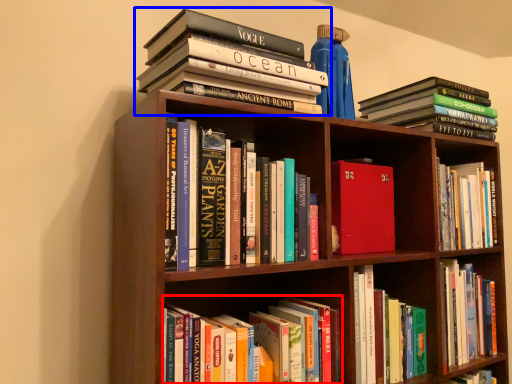
Question: Which object appears farthest to the camera in this image, book (highlighted by a red box) or book (highlighted by a blue box)?

Choices:
 (A) book
 (B) book

Answer: (B)